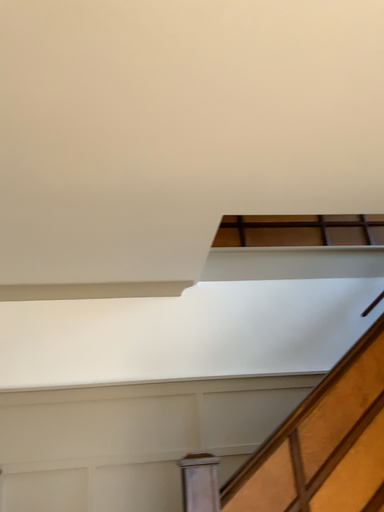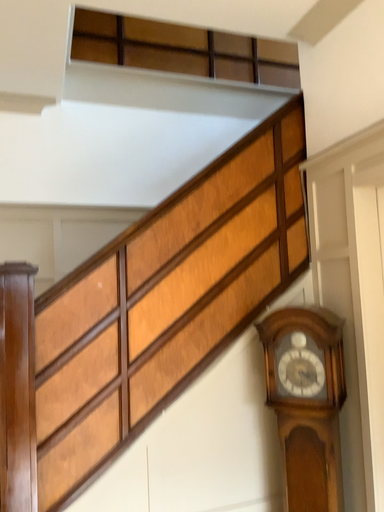
Question: How did the camera likely rotate when shooting the video?

Choices:
 (A) rotated upward
 (B) rotated downward

Answer: (B)